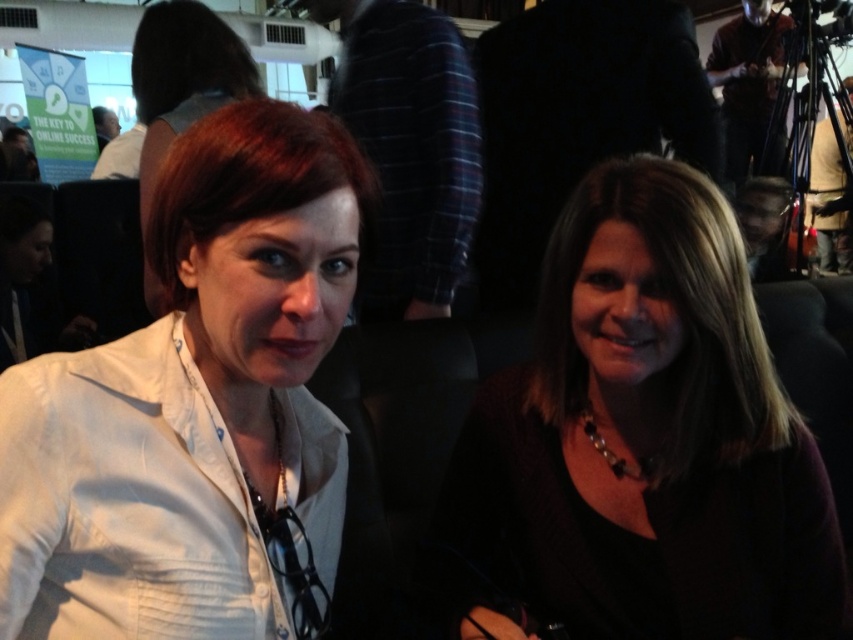
You are organizing a photoshoot and need to ensure that the white matte blazer at center and the matte white shirt at center are displayed clearly. Which item should be placed closer to the camera to avoid blurriness if the camera focuses on the narrower object?

The white matte blazer at center has a lesser width compared to the matte white shirt at center. Therefore, to avoid blurriness when focusing on the narrower object, the white matte blazer at center should be placed closer to the camera.

You are standing in the room where the image was taken and want to place a small decoration exactly at the point labeled as point (62, 465). The decoration requires a minimum of 24 inches of space from the camera to avoid being too close. Will this point be suitable for placing the decoration?

The distance of point (62, 465) from the camera is 25.77 inches, which is more than the required 24 inches. Therefore, the point is suitable for placing the decoration.

You are a photographer at a business event. You need to capture a photo of the dark brown hair at center and the matte white shirt at center. Which object should you focus on first if you want to ensure both are in the frame?

The dark brown hair at center is positioned on the right side of matte white shirt at center, so you should focus on the matte white shirt at center first to ensure both are in the frame.